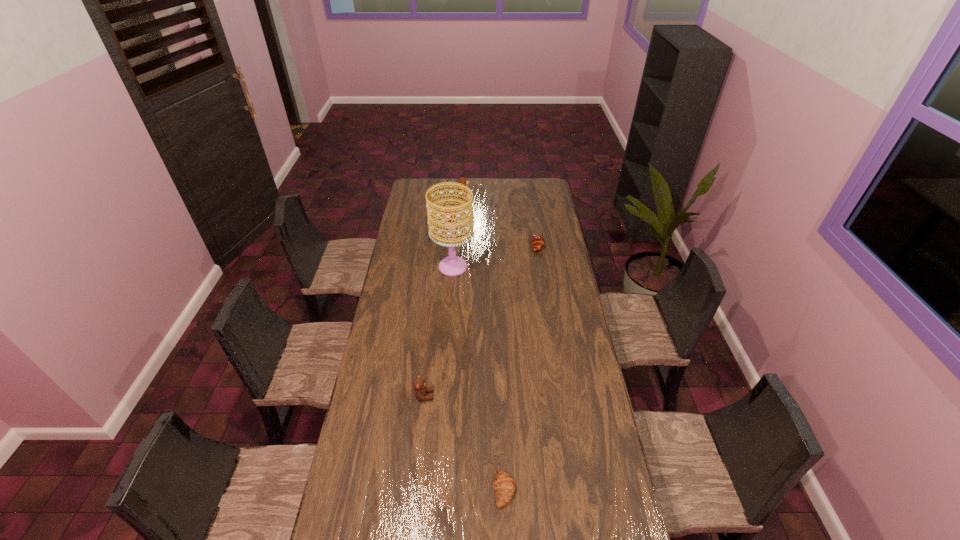
This screenshot has height=540, width=960. Identify the location of vacant point located on the face of the farthest object. (492, 193).

Image resolution: width=960 pixels, height=540 pixels. I want to click on free space located 0.380m on the face of the left teddy bear, so (531, 395).

Locate an element on the screen. vacant region located 0.290m on the left of the rightmost object is located at coordinates (478, 245).

At what (x,y) coordinates should I click in order to perform the action: click on free space located on the right of the nearest object. Please return your answer as a coordinate pair (x, y). This screenshot has height=540, width=960. Looking at the image, I should click on (555, 490).

This screenshot has height=540, width=960. In order to click on object present at the far edge in this screenshot , I will do `click(462, 180)`.

At what (x,y) coordinates should I click in order to perform the action: click on object situated at the right edge. Please return your answer as a coordinate pair (x, y). Image resolution: width=960 pixels, height=540 pixels. Looking at the image, I should click on (538, 242).

This screenshot has height=540, width=960. What are the coordinates of `blank space at the far edge of the desktop` in the screenshot? It's located at (519, 186).

The height and width of the screenshot is (540, 960). In the image, there is a desktop. Identify the location of vacant space at the left edge. (348, 451).

This screenshot has height=540, width=960. I want to click on vacant space at the right edge, so click(546, 284).

Locate an element on the screen. unoccupied area between the tallest object and the nearer teddy bear is located at coordinates (439, 331).